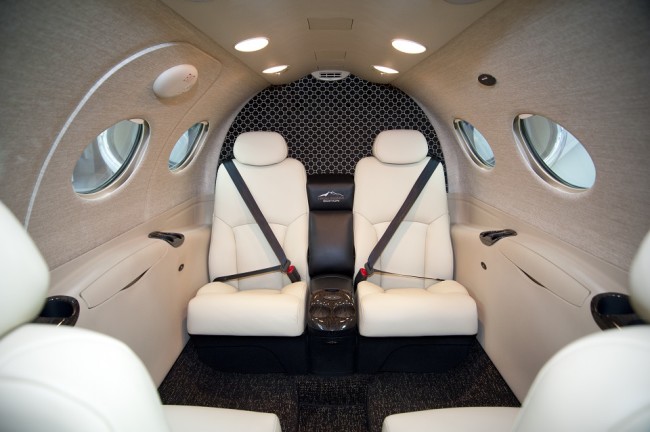
The width and height of the screenshot is (650, 432). Identify the location of seat cover. (294, 246).